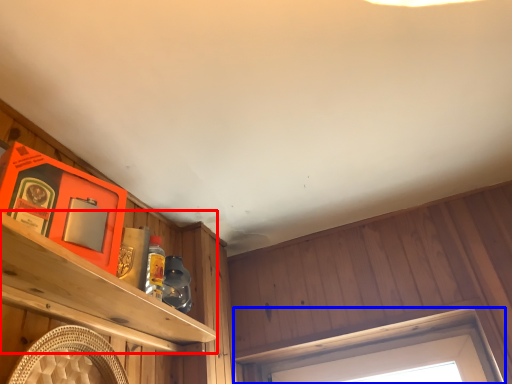
Question: Which object is further to the camera taking this photo, shelf (highlighted by a red box) or window (highlighted by a blue box)?

Choices:
 (A) shelf
 (B) window

Answer: (B)